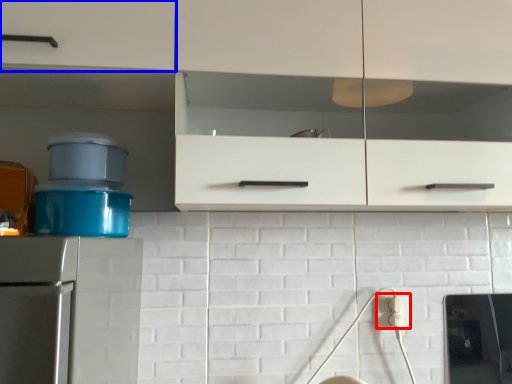
Question: Among these objects, which one is farthest to the camera, electric outlet (highlighted by a red box) or cabinetry (highlighted by a blue box)?

Choices:
 (A) electric outlet
 (B) cabinetry

Answer: (A)